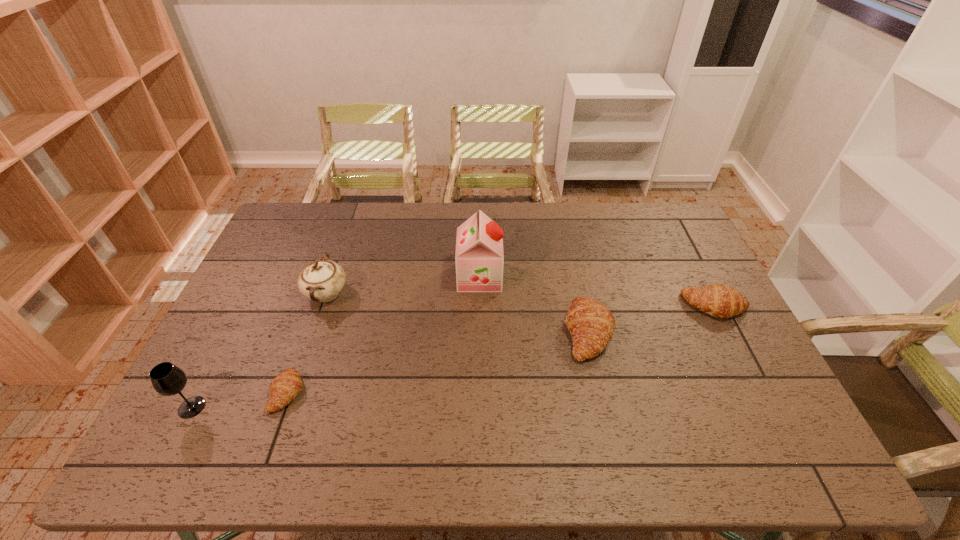
You are a GUI agent. You are given a task and a screenshot of the screen. Output one action in this format:
    pyautogui.click(x=<x>, y=<y>)
    Task: Click on the free location at the far edge
    Image resolution: width=960 pixels, height=540 pixels.
    Given the screenshot: What is the action you would take?
    pyautogui.click(x=566, y=220)

In the image, there is a desktop. Where is `vacant space at the near edge`? Image resolution: width=960 pixels, height=540 pixels. vacant space at the near edge is located at coordinates (462, 418).

Image resolution: width=960 pixels, height=540 pixels. I want to click on vacant position at the left edge of the desktop, so click(275, 243).

Where is `free location at the right edge`? free location at the right edge is located at coordinates (721, 359).

This screenshot has width=960, height=540. Identify the location of free region at the far left corner. (297, 238).

This screenshot has height=540, width=960. I want to click on vacant area that lies between the leftmost object and the nearest crescent roll, so tap(239, 400).

The image size is (960, 540). Identify the location of empty space that is in between the fifth object from left to right and the leftmost crescent roll. (438, 362).

Identify the location of vacant region between the shortest crescent roll and the leftmost object. (239, 400).

At what (x,y) coordinates should I click in order to perform the action: click on free space between the second crescent roll from right to left and the soya milk. Please return your answer as a coordinate pair (x, y). The height and width of the screenshot is (540, 960). Looking at the image, I should click on (534, 304).

You are a GUI agent. You are given a task and a screenshot of the screen. Output one action in this format:
    pyautogui.click(x=<x>, y=<y>)
    Task: Click on the free space between the chinaware and the leftmost crescent roll
    
    Given the screenshot: What is the action you would take?
    pyautogui.click(x=307, y=343)